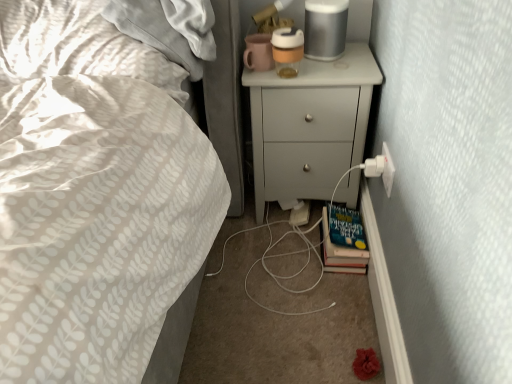
Question: Is white plastic electric outlet at lower right not near hardcover book at lower right?

Choices:
 (A) no
 (B) yes

Answer: (A)

Question: Does white plastic electric outlet at lower right lie behind hardcover book at lower right?

Choices:
 (A) yes
 (B) no

Answer: (B)

Question: Can we say white plastic electric outlet at lower right lies outside hardcover book at lower right?

Choices:
 (A) yes
 (B) no

Answer: (A)

Question: Is hardcover book at lower right inside white plastic electric outlet at lower right?

Choices:
 (A) no
 (B) yes

Answer: (A)

Question: Considering the relative sizes of white plastic electric outlet at lower right and hardcover book at lower right in the image provided, is white plastic electric outlet at lower right bigger than hardcover book at lower right?

Choices:
 (A) no
 (B) yes

Answer: (A)

Question: In the image, is hardcover book at lower right positioned in front of or behind white plastic electric outlet at lower right?

Choices:
 (A) front
 (B) behind

Answer: (B)

Question: In terms of width, does hardcover book at lower right look wider or thinner when compared to white plastic electric outlet at lower right?

Choices:
 (A) wide
 (B) thin

Answer: (A)

Question: Is point (332, 258) closer or farther from the camera than point (387, 172)?

Choices:
 (A) farther
 (B) closer

Answer: (A)

Question: From the image's perspective, relative to white plastic electric outlet at lower right, is hardcover book at lower right above or below?

Choices:
 (A) above
 (B) below

Answer: (B)

Question: From the image's perspective, is white plastic electric outlet at lower right located above or below white matte chest of drawers at upper right?

Choices:
 (A) above
 (B) below

Answer: (B)

Question: Is white plastic electric outlet at lower right wider or thinner than white matte chest of drawers at upper right?

Choices:
 (A) thin
 (B) wide

Answer: (A)

Question: Is white plastic electric outlet at lower right taller or shorter than white matte chest of drawers at upper right?

Choices:
 (A) tall
 (B) short

Answer: (B)

Question: Considering their positions, is white plastic electric outlet at lower right located in front of or behind white matte chest of drawers at upper right?

Choices:
 (A) behind
 (B) front

Answer: (B)

Question: Considering the positions of white plastic electric outlet at lower right and hardcover book at lower right in the image, is white plastic electric outlet at lower right bigger or smaller than hardcover book at lower right?

Choices:
 (A) big
 (B) small

Answer: (B)

Question: Based on their positions, is white plastic electric outlet at lower right located to the left or right of hardcover book at lower right?

Choices:
 (A) left
 (B) right

Answer: (B)